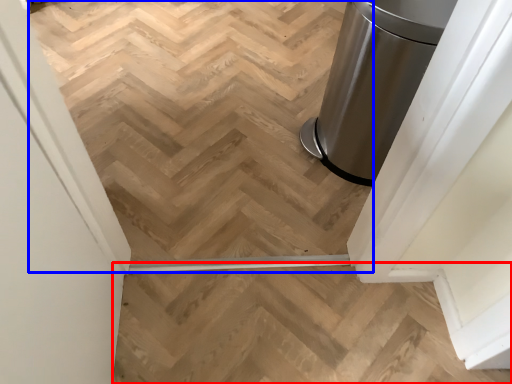
Question: Among these objects, which one is farthest to the camera, stairs (highlighted by a red box) or stairwell (highlighted by a blue box)?

Choices:
 (A) stairs
 (B) stairwell

Answer: (B)